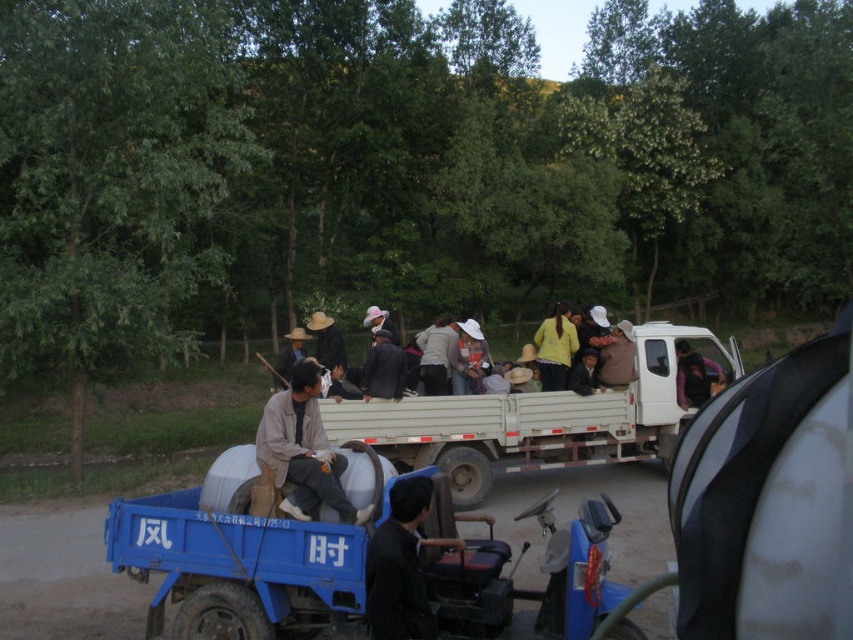
Looking at this image, you are standing near the blue motorized cart in the rural scene. You need to locate the light brown straw hat at center and the white matte truck at center. Which object is positioned higher from the ground?

The light brown straw hat at center is positioned higher from the ground than the white matte truck at center because the white matte truck at center is below the light brown straw hat at center.

You are a delivery person who needs to load a package onto the white matte truck at center. The package requires a space wider than the light brown straw hat at center. Can the truck provide enough width for the package?

The white matte truck at center is wider than the light brown straw hat at center, so the truck can accommodate the package as it has sufficient width.

You are standing at the edge of the dirt road and want to take a photo of the white matte pickup truck at center. If your camera has a maximum focus range of 1.5 meters, will you be able to capture the truck clearly?

The white matte pickup truck at center is 1.51 meters away from the camera, which exceeds the maximum focus range of 1.5 meters. Therefore, the camera won the truck clearly.